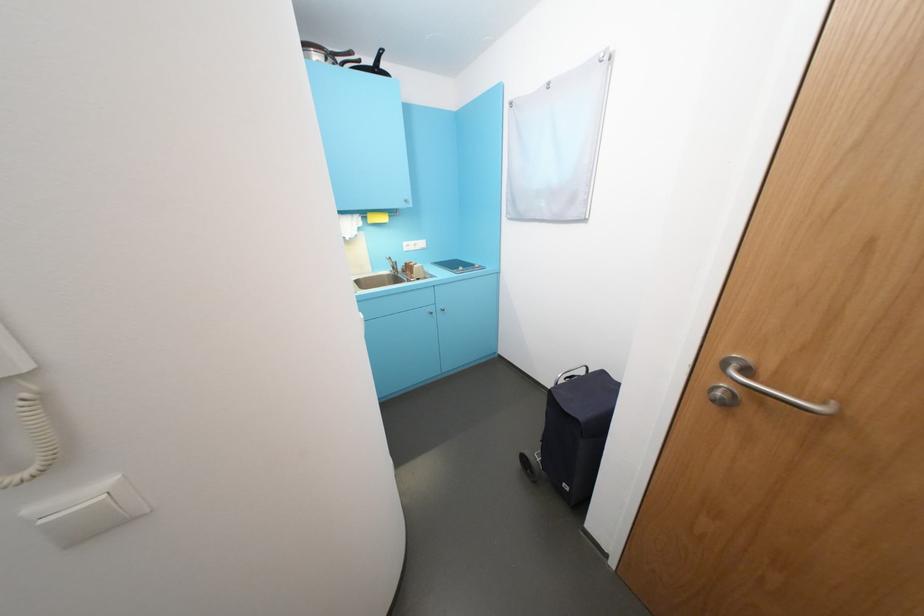
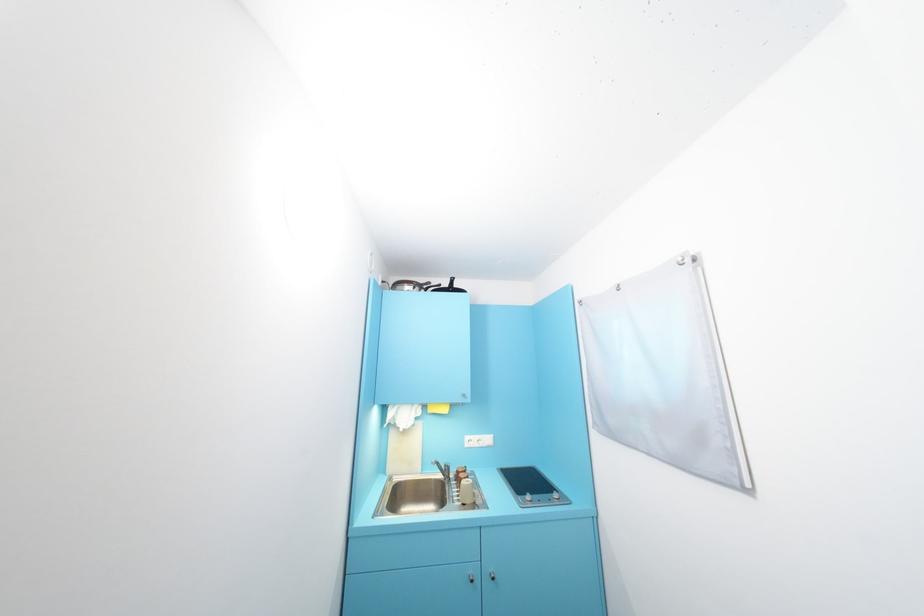
The point at (556,89) is marked in the first image. Where is the corresponding point in the second image?

(626, 291)